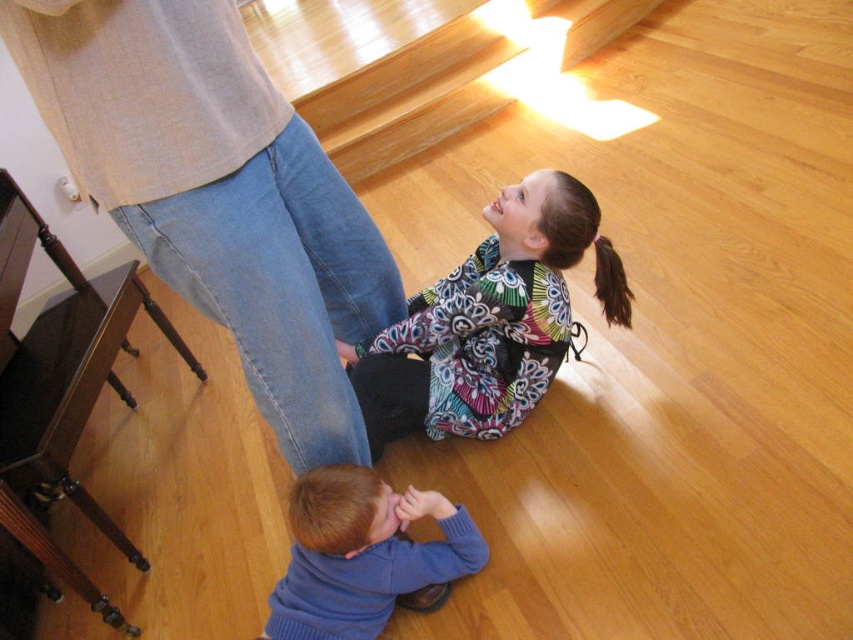
Question: Is light blue denim jeans at upper left above multicolored fabric dress at center?

Choices:
 (A) yes
 (B) no

Answer: (A)

Question: In this image, where is light blue denim jeans at upper left located relative to blue sweater at lower center?

Choices:
 (A) left
 (B) right

Answer: (A)

Question: Considering the real-world distances, which object is closest to the light blue denim jeans at upper left?

Choices:
 (A) blue sweater at lower center
 (B) multicolored fabric dress at center

Answer: (A)

Question: Among these points, which one is nearest to the camera?

Choices:
 (A) (514, 333)
 (B) (486, 552)

Answer: (B)

Question: Among these objects, which one is farthest from the camera?

Choices:
 (A) multicolored fabric dress at center
 (B) blue sweater at lower center
 (C) light blue denim jeans at upper left

Answer: (A)

Question: Can you confirm if light blue denim jeans at upper left is positioned to the right of blue sweater at lower center?

Choices:
 (A) no
 (B) yes

Answer: (A)